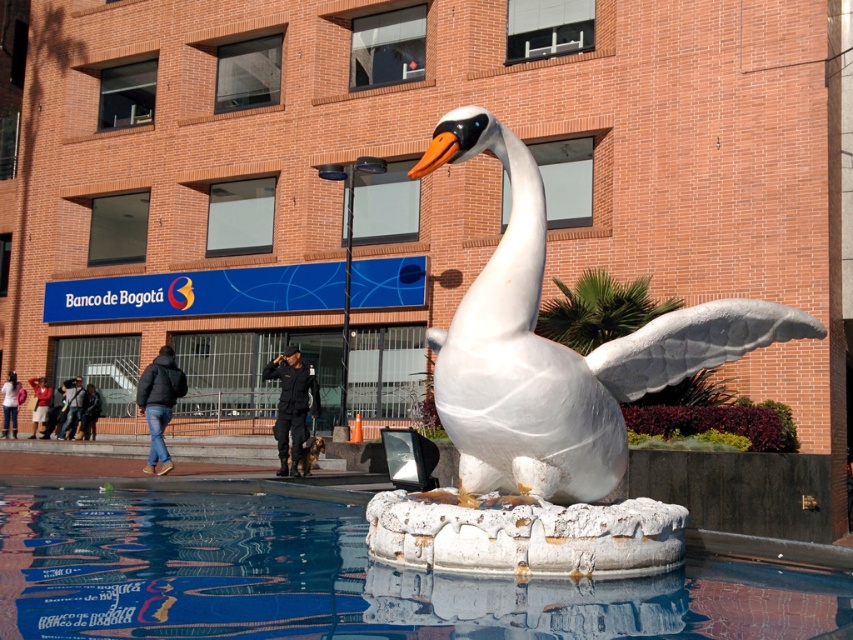
Who is lower down, white stone pool at center or white marble swan at center?

Positioned lower is white stone pool at center.

Who is shorter, white stone pool at center or white marble swan at center?

white stone pool at center

Between point (241, 628) and point (706, 324), which one is positioned in front?

Point (241, 628)

Where is `white stone pool at center`? This screenshot has width=853, height=640. white stone pool at center is located at coordinates click(x=341, y=579).